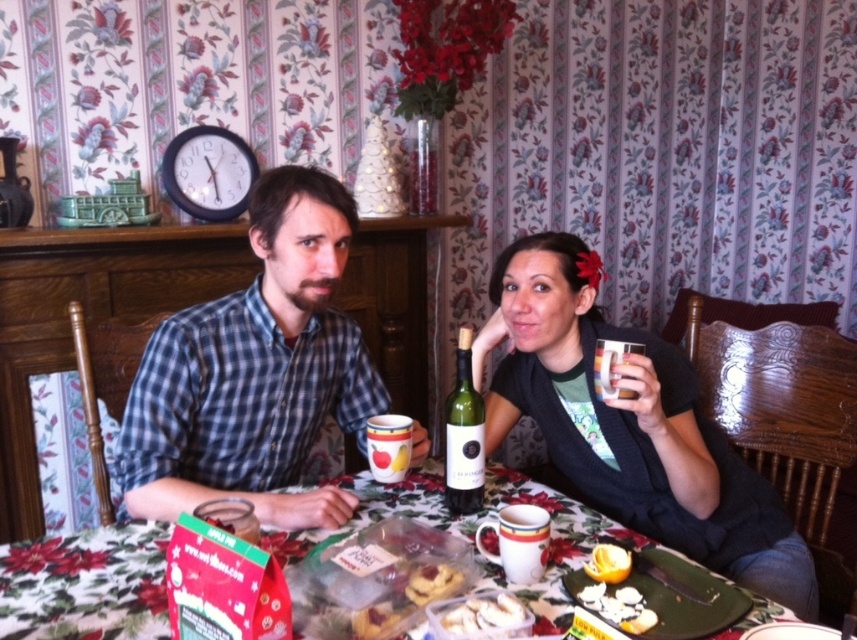
Is green matte wine bottle at center above white crumbly cookies at lower center?

Indeed, green matte wine bottle at center is positioned over white crumbly cookies at lower center.

Who is higher up, green matte wine bottle at center or white crumbly cookies at lower center?

green matte wine bottle at center is above.

Is point (450, 500) in front of point (466, 630)?

No.

Find the location of `green matte wine bottle at center`. green matte wine bottle at center is located at coordinates (464, 435).

Does point (93, 573) lie in front of point (615, 547)?

Yes.

Which is more to the right, floral-patterned tablecloth at center or shiny orange slice at lower center?

From the viewer's perspective, shiny orange slice at lower center appears more on the right side.

Which is in front, point (84, 593) or point (618, 564)?

Point (84, 593) is more forward.

Where is `floral-patterned tablecloth at center`? Image resolution: width=857 pixels, height=640 pixels. floral-patterned tablecloth at center is located at coordinates (87, 584).

Which is below, checkered fabric shirt at left or matte black sweater at center?

matte black sweater at center is below.

Does checkered fabric shirt at left have a lesser height compared to matte black sweater at center?

Incorrect, checkered fabric shirt at left's height does not fall short of matte black sweater at center's.

The height and width of the screenshot is (640, 857). Identify the location of checkered fabric shirt at left. (633, 428).